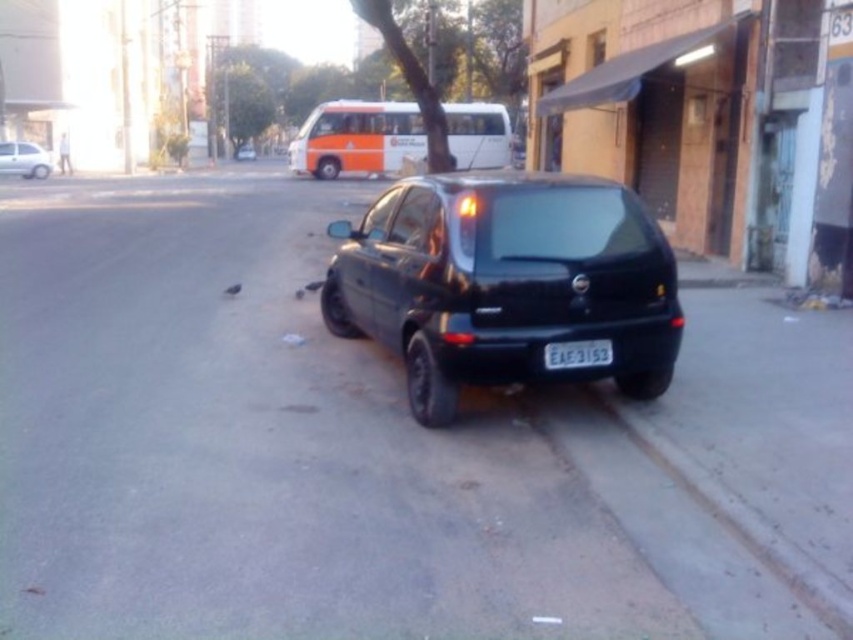
You are a delivery driver who needs to load a package onto the glossy black car at center. The license plate on the black plastic license plate at rear is blocking the trunk. Can you slide the license plate out of the way to access the trunk?

The black plastic license plate at rear is shorter than the glossy black car at center, so it can be slid out of the way to access the trunk since it is smaller in size.

You are a pedestrian standing at the point with coordinates point (x=235, y=154). You want to cross the road to reach the other side. Is there a safe path between point (x=317, y=160) and your current position?

Point (x=317, y=160) is in front of point (x=235, y=154), so there is a safe path between them.